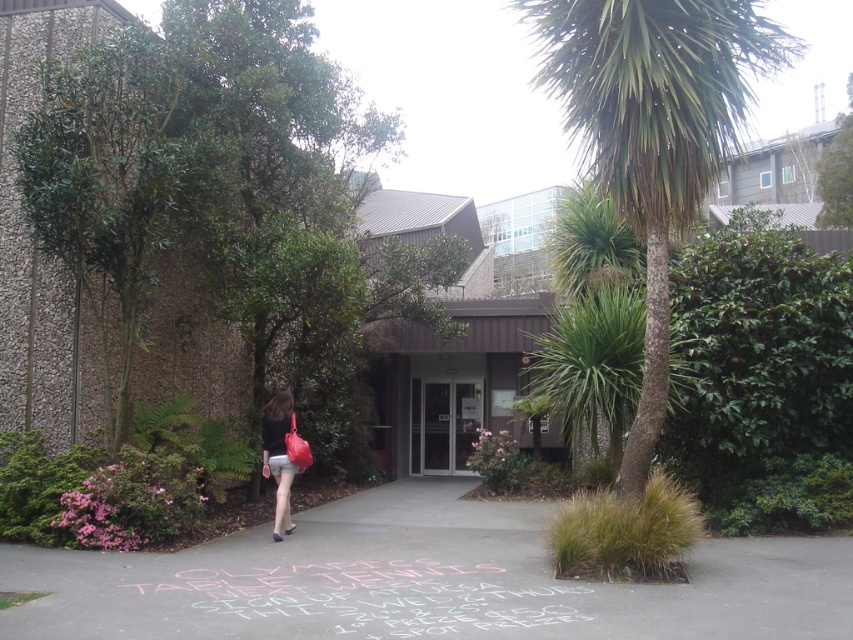
Is green leafy palm tree at upper right further to camera compared to matte pink short at center?

No, it is in front of matte pink short at center.

Who is shorter, green leafy palm tree at upper right or matte pink short at center?

matte pink short at center

What do you see at coordinates (654, 131) in the screenshot?
I see `green leafy palm tree at upper right` at bounding box center [654, 131].

Locate an element on the screen. Image resolution: width=853 pixels, height=640 pixels. green leafy palm tree at upper right is located at coordinates (654, 131).

Is point (399, 289) positioned in front of point (361, 636)?

No, (399, 289) is behind (361, 636).

The height and width of the screenshot is (640, 853). Describe the element at coordinates (219, 189) in the screenshot. I see `green leafy tree at left` at that location.

The image size is (853, 640). Identify the location of green leafy tree at left. 219,189.

Can you confirm if green leafy tree at left is positioned to the left of matte black skirt at lower left?

Correct, you'll find green leafy tree at left to the left of matte black skirt at lower left.

Does point (120, 65) lie behind point (286, 490)?

No.

Is point (218, 49) positioned in front of point (263, 468)?

No, (218, 49) is behind (263, 468).

Where is `green leafy tree at left`? The image size is (853, 640). green leafy tree at left is located at coordinates (219, 189).